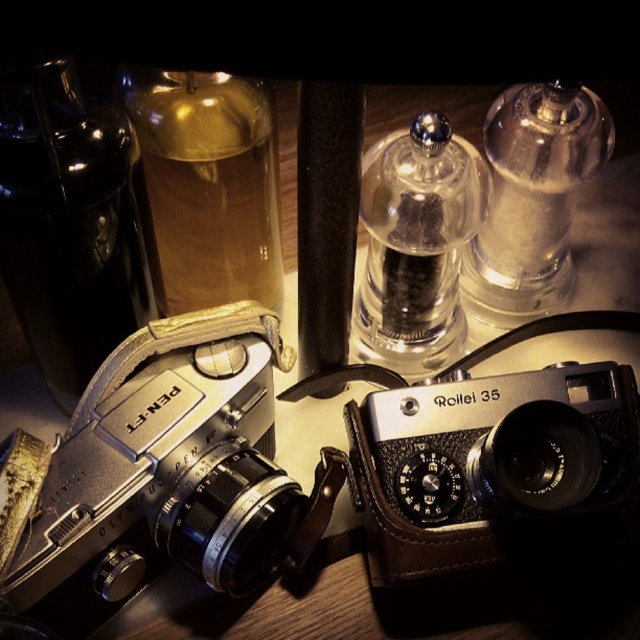
You are setting up a table for a dinner party and need to place the black glass bottle at left and the transparent glass pepper shaker at center. According to the image, where should you position the black glass bottle relative to the transparent glass pepper shaker?

The black glass bottle at left should be placed under the transparent glass pepper shaker at center as per the image.

You are standing in front of a display of vintage cameras. There are two points marked on the wooden surface where the cameras are placed. The first point is at coordinates point (124, 477) and the second at point (412, 337). Which point is closer to you?

Point point (124, 477) is closer to the viewer than point (412, 337).

You are setting up a display for a photography exhibition and need to ensure that the translucent glass bottle at upper left does not block the view of the matte black camera at center. Based on their positions, is the bottle currently obscuring the camera?

The matte black camera at center is positioned under the translucent glass bottle at upper left, so the bottle is currently blocking the view of the camera. You should adjust their positions to ensure the camera remains visible.